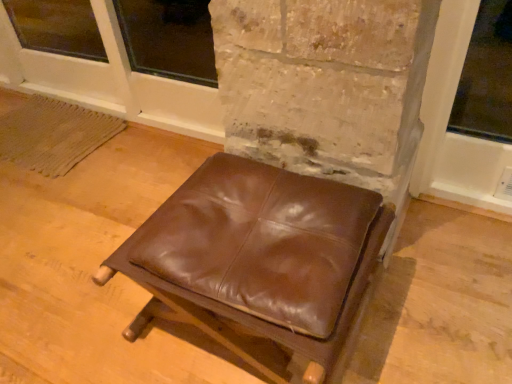
Locate an element on the screen. This screenshot has width=512, height=384. vacant space that is to the left of brown leather ottoman at center is located at coordinates [83, 301].